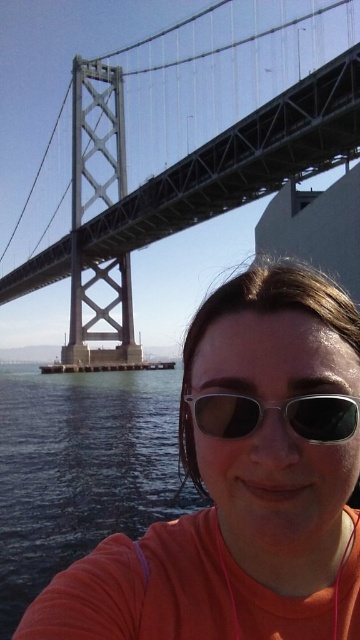
Based on the photo, can you confirm if metallic gray suspension bridge at upper center is positioned below transparent water at lower left?

Incorrect, metallic gray suspension bridge at upper center is not positioned below transparent water at lower left.

Can you confirm if metallic gray suspension bridge at upper center is positioned to the right of transparent water at lower left?

Yes, metallic gray suspension bridge at upper center is to the right of transparent water at lower left.

Which is in front, point (106, 221) or point (144, 452)?

Point (144, 452) is in front.

You are a GUI agent. You are given a task and a screenshot of the screen. Output one action in this format:
    pyautogui.click(x=<x>, y=<y>)
    Task: Click on the metallic gray suspension bridge at upper center
    
    Given the screenshot: What is the action you would take?
    pyautogui.click(x=191, y=147)

Can you confirm if matte orange shirt at center is bigger than sunglasses at center?

Yes, matte orange shirt at center is bigger than sunglasses at center.

Is matte orange shirt at center to the right of sunglasses at center from the viewer's perspective?

Correct, you'll find matte orange shirt at center to the right of sunglasses at center.

Measure the distance between point (285,342) and camera.

Point (285,342) is 37.37 meters away from camera.

Locate an element on the screen. matte orange shirt at center is located at coordinates (243, 483).

Is matte orange shirt at center bigger than transparent water at lower left?

Actually, matte orange shirt at center might be smaller than transparent water at lower left.

Who is more distant from viewer, (171,529) or (84,440)?

Positioned behind is point (84,440).

Between point (344, 308) and point (132, 528), which one is positioned behind?

The point (132, 528) is behind.

The width and height of the screenshot is (360, 640). Find the location of `matte orange shirt at center`. matte orange shirt at center is located at coordinates (243, 483).